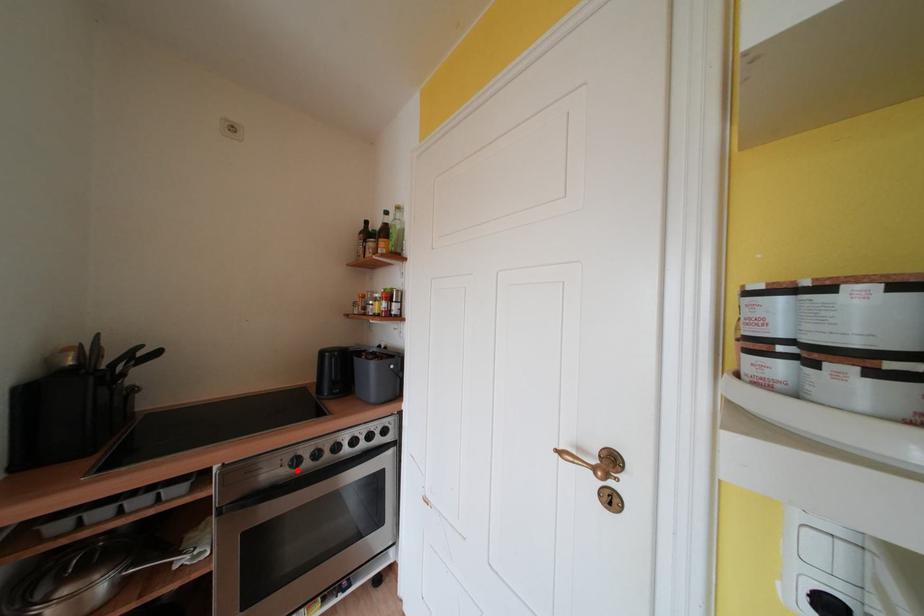
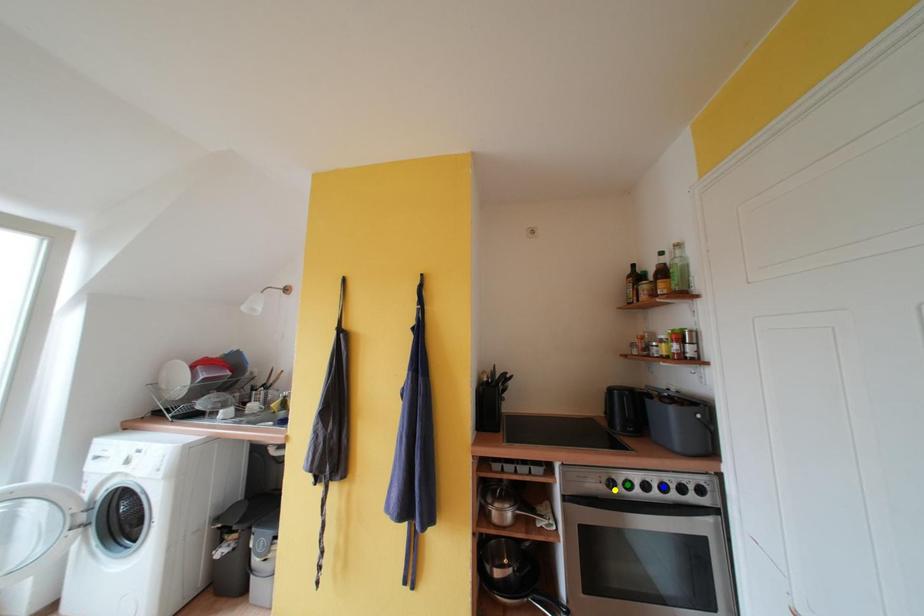
Question: I am providing you with two images of the same scene from different viewpoints. A red point is marked on the first image. You are given multiple points on the second image. Which point in image 2 is actually the same real-world point as the red point in image 1?

Choices:
 (A) yellow point
 (B) green point
 (C) blue point

Answer: (A)